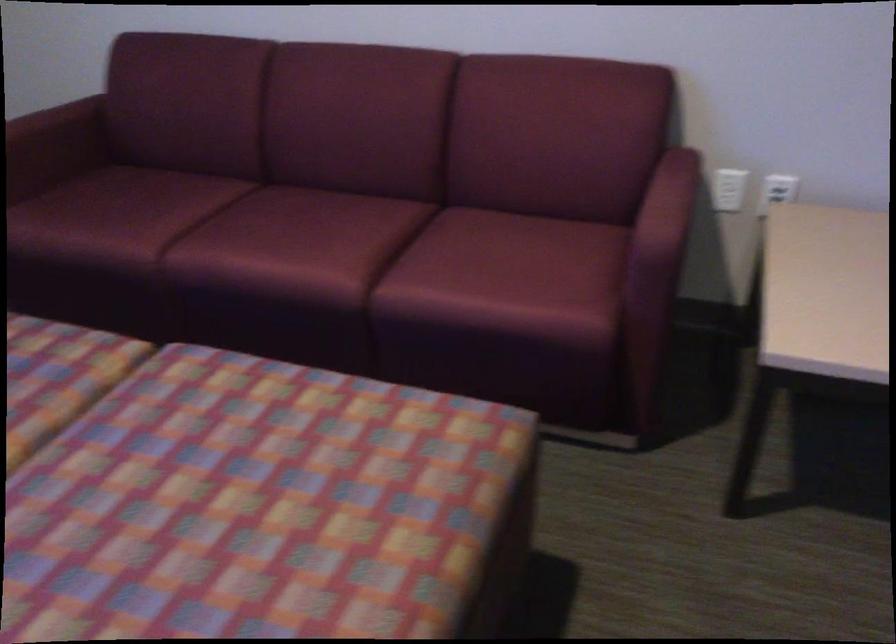
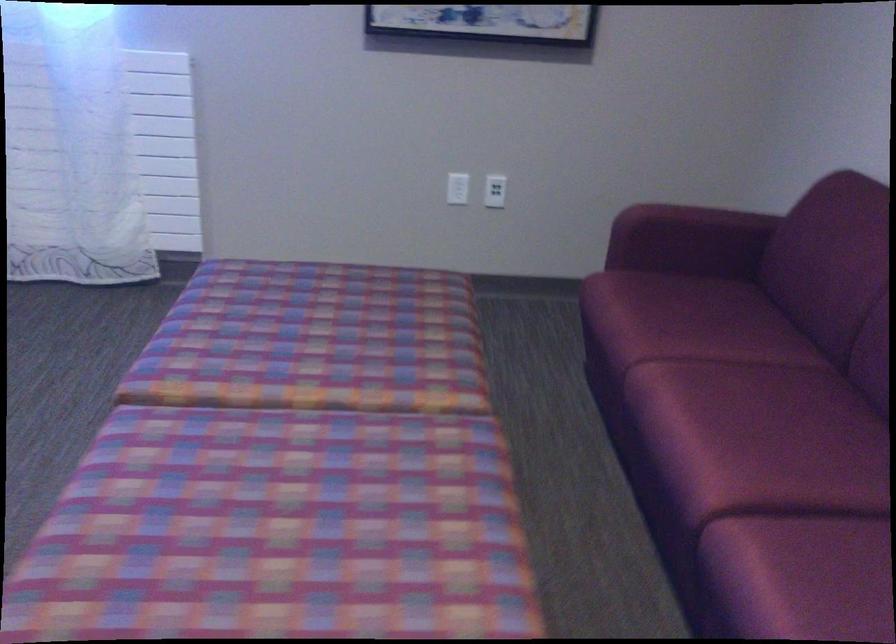
Question: Based on the continuous images, in which direction is the camera rotating? Reply with the corresponding letter.

Choices:
 (A) Left
 (B) Right
 (C) Up
 (D) Down

Answer: (A)